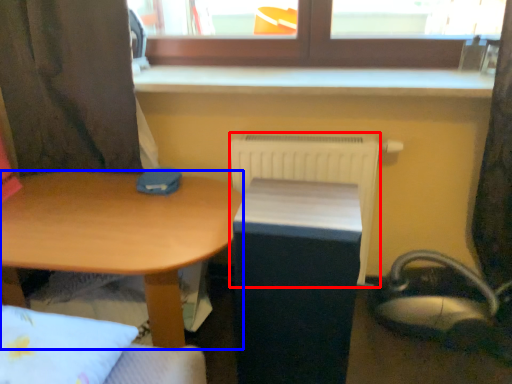
Question: Which point is further to the camera, radiator (highlighted by a red box) or desk (highlighted by a blue box)?

Choices:
 (A) radiator
 (B) desk

Answer: (A)